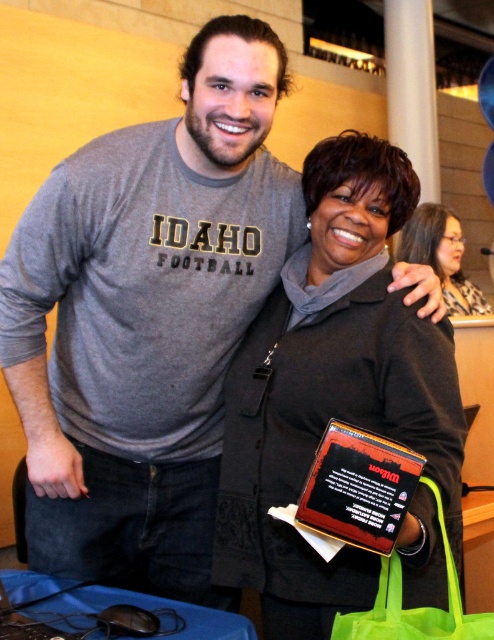
Can you confirm if matte black jacket at center is positioned above leopard print scarf at upper right?

Incorrect, matte black jacket at center is not positioned above leopard print scarf at upper right.

Is matte black jacket at center thinner than leopard print scarf at upper right?

Indeed, matte black jacket at center has a lesser width compared to leopard print scarf at upper right.

Is point (296, 406) positioned in front of point (428, 209)?

Yes, it is in front of point (428, 209).

Image resolution: width=494 pixels, height=640 pixels. Find the location of `matte black jacket at center`. matte black jacket at center is located at coordinates pyautogui.click(x=331, y=388).

Does point (396, 525) come farther from viewer compared to point (399, 636)?

No, (396, 525) is closer to viewer.

Is black plastic plaque at center below neon green fabric shopping bag at lower right?

Incorrect, black plastic plaque at center is not positioned below neon green fabric shopping bag at lower right.

The height and width of the screenshot is (640, 494). Identify the location of black plastic plaque at center. (359, 486).

Between black plastic plaque at center and leopard print scarf at upper right, which one is positioned lower?

black plastic plaque at center is lower down.

Is point (406, 449) positioned before point (442, 241)?

Yes, it is.

The image size is (494, 640). What are the coordinates of `black plastic plaque at center` in the screenshot? It's located at (359, 486).